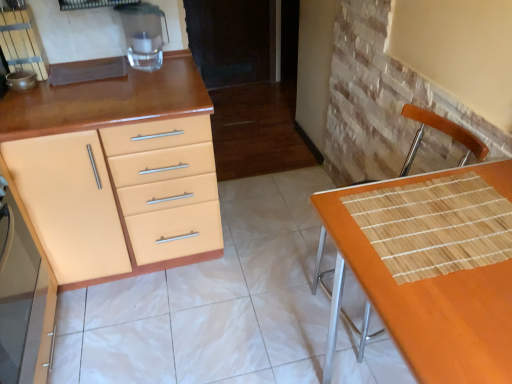
Question: Considering the relative sizes of matte beige cabinet at left, the 2th cabinetry from the back, and matte orange cabinet at left, acting as the second cabinetry starting from the front, in the image provided, is matte beige cabinet at left, the 2th cabinetry from the back, shorter than matte orange cabinet at left, acting as the second cabinetry starting from the front,?

Choices:
 (A) yes
 (B) no

Answer: (A)

Question: Can you confirm if matte beige cabinet at left, the first cabinetry viewed from the front, is positioned to the right of matte orange cabinet at left, the 1th cabinetry from the back?

Choices:
 (A) yes
 (B) no

Answer: (B)

Question: Is matte orange cabinet at left, the 1th cabinetry from the back, located within matte beige cabinet at left, the 2th cabinetry from the back?

Choices:
 (A) no
 (B) yes

Answer: (A)

Question: Is matte beige cabinet at left, the first cabinetry viewed from the front, closer to the viewer compared to matte orange cabinet at left, the 1th cabinetry from the back?

Choices:
 (A) no
 (B) yes

Answer: (B)

Question: Can you confirm if matte beige cabinet at left, the first cabinetry viewed from the front, is bigger than matte orange cabinet at left, acting as the second cabinetry starting from the front?

Choices:
 (A) no
 (B) yes

Answer: (A)

Question: From a real-world perspective, is orange woven mat at lower right positioned above or below matte beige cabinet at left, the first cabinetry viewed from the front?

Choices:
 (A) above
 (B) below

Answer: (B)

Question: Considering the relative positions of orange woven mat at lower right and matte beige cabinet at left, the 2th cabinetry from the back, in the image provided, is orange woven mat at lower right to the left or to the right of matte beige cabinet at left, the 2th cabinetry from the back,?

Choices:
 (A) right
 (B) left

Answer: (A)

Question: Is orange woven mat at lower right bigger or smaller than matte beige cabinet at left, the first cabinetry viewed from the front?

Choices:
 (A) big
 (B) small

Answer: (A)

Question: From the image's perspective, is orange woven mat at lower right positioned above or below matte beige cabinet at left, the 2th cabinetry from the back?

Choices:
 (A) below
 (B) above

Answer: (A)

Question: Is point (23, 294) closer or farther from the camera than point (359, 211)?

Choices:
 (A) farther
 (B) closer

Answer: (A)

Question: From a real-world perspective, is matte beige cabinet at left, the first cabinetry viewed from the front, above or below orange woven mat at lower right?

Choices:
 (A) below
 (B) above

Answer: (B)

Question: From the image's perspective, relative to orange woven mat at lower right, is matte beige cabinet at left, the 2th cabinetry from the back, above or below?

Choices:
 (A) above
 (B) below

Answer: (A)

Question: Which is correct: matte beige cabinet at left, the 2th cabinetry from the back, is inside orange woven mat at lower right, or outside of it?

Choices:
 (A) outside
 (B) inside

Answer: (A)

Question: Is matte orange cabinet at left, the 1th cabinetry from the back, to the left or to the right of matte beige cabinet at left, the 2th cabinetry from the back, in the image?

Choices:
 (A) left
 (B) right

Answer: (B)

Question: From the image's perspective, is matte orange cabinet at left, acting as the second cabinetry starting from the front, located above or below matte beige cabinet at left, the 2th cabinetry from the back?

Choices:
 (A) below
 (B) above

Answer: (B)